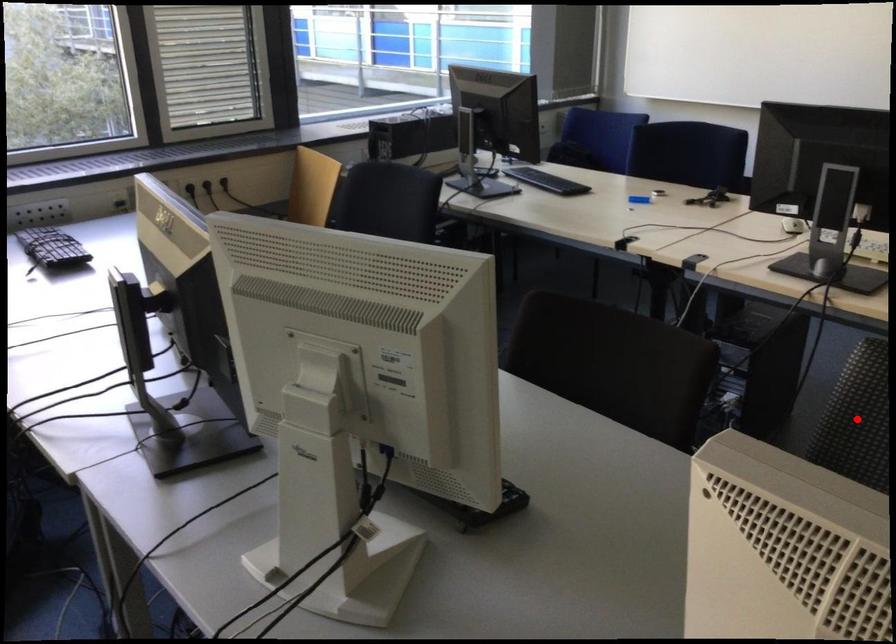
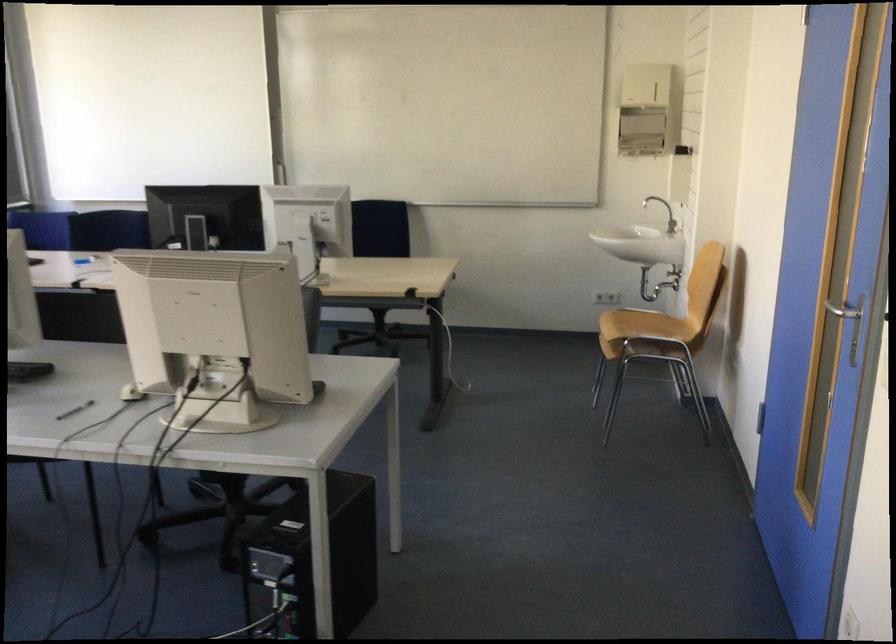
Question: I am providing you with two images of the same scene from different viewpoints. A red point is marked on the first image. Is the red point's position out of view in image 2?

Choices:
 (A) Yes
 (B) No

Answer: (A)